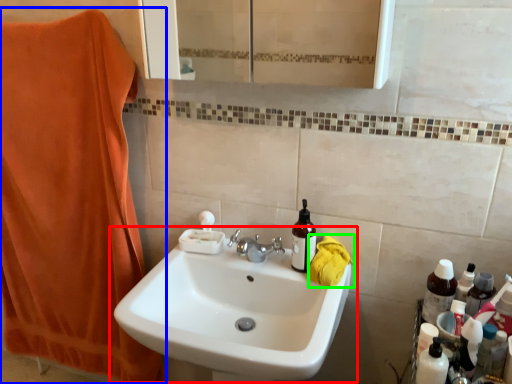
Question: Which object is the farthest from sink (highlighted by a red box)? Choose among these: beach towel (highlighted by a blue box) or beach towel (highlighted by a green box).

Choices:
 (A) beach towel
 (B) beach towel

Answer: (A)